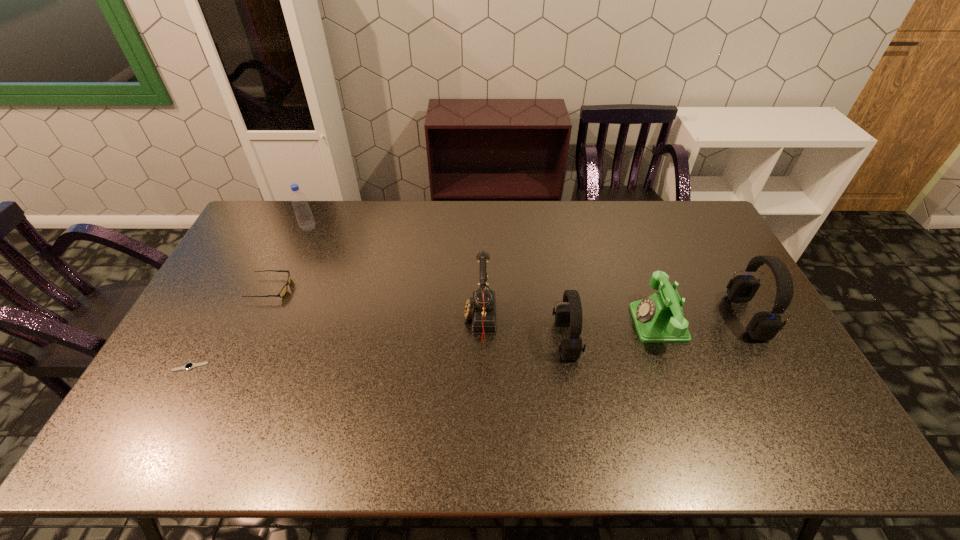
The height and width of the screenshot is (540, 960). In order to click on the fourth object from right to left in this screenshot , I will do `click(481, 307)`.

You are a GUI agent. You are given a task and a screenshot of the screen. Output one action in this format:
    pyautogui.click(x=<x>, y=<y>)
    Task: Click on the left telephone
    The height and width of the screenshot is (540, 960).
    Given the screenshot: What is the action you would take?
    pyautogui.click(x=481, y=307)

This screenshot has width=960, height=540. What are the coordinates of `vacant area situated on the headband of the left headset` in the screenshot? It's located at (645, 339).

I want to click on vacant space situated on the headband of the taller headset, so click(679, 316).

Image resolution: width=960 pixels, height=540 pixels. I want to click on free space located 0.350m on the headband of the taller headset, so click(615, 316).

Locate an element on the screen. Image resolution: width=960 pixels, height=540 pixels. free space located on the headband of the taller headset is located at coordinates (655, 316).

Where is `vacant region located on the back of the bottle`? This screenshot has height=540, width=960. vacant region located on the back of the bottle is located at coordinates (318, 206).

I want to click on free spot located on the front-facing side of the second shortest object, so click(x=313, y=288).

I want to click on vacant area situated on the dial of the shorter telephone, so click(522, 323).

Identify the location of vacant space located on the dial of the shorter telephone. The width and height of the screenshot is (960, 540). (607, 323).